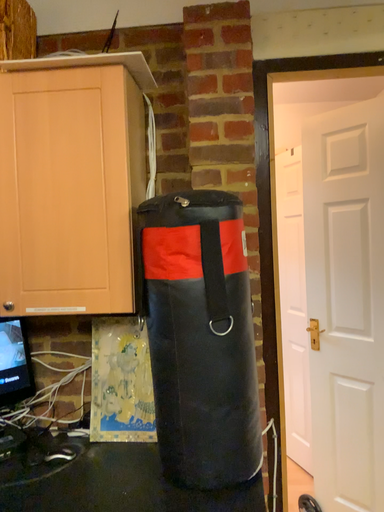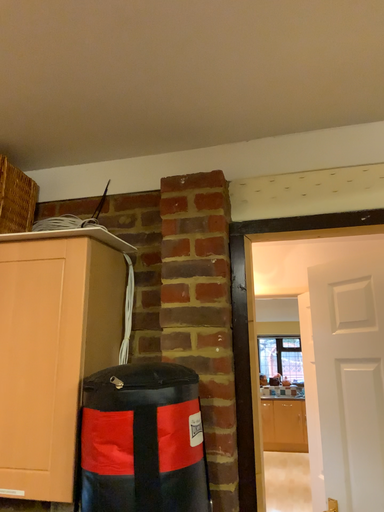
Question: How did the camera likely rotate when shooting the video?

Choices:
 (A) rotated right
 (B) rotated left

Answer: (B)